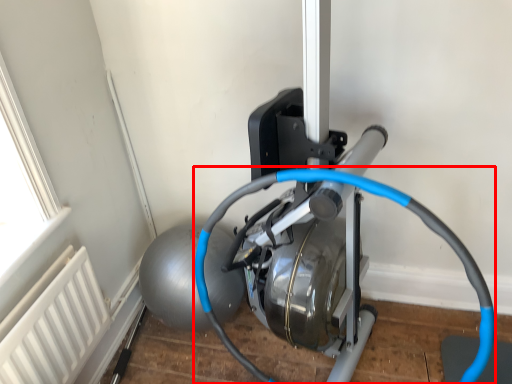
Question: Observing the image, what is the correct spatial positioning of wire (annotated by the red box) in reference to radiator?

Choices:
 (A) right
 (B) left

Answer: (A)